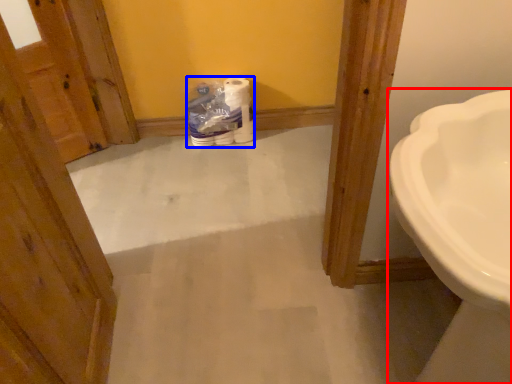
Question: Which point is closer to the camera, sink (highlighted by a red box) or toilet paper (highlighted by a blue box)?

Choices:
 (A) sink
 (B) toilet paper

Answer: (A)